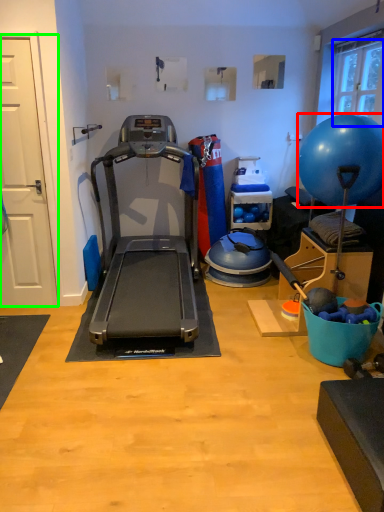
Question: Which is farther away from ball (highlighted by a red box)? window screen (highlighted by a blue box) or door (highlighted by a green box)?

Choices:
 (A) window screen
 (B) door

Answer: (B)